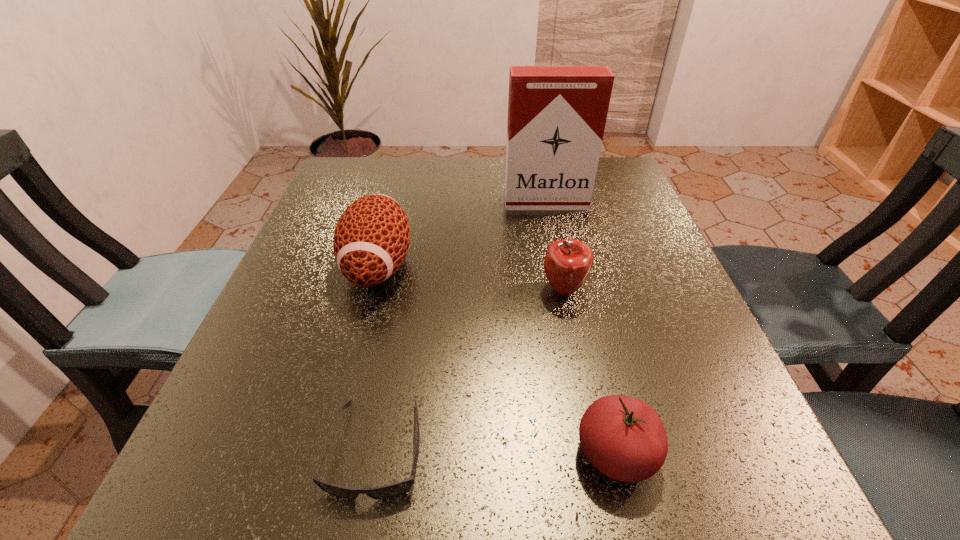
This screenshot has height=540, width=960. I want to click on the farthest object, so click(x=557, y=115).

The height and width of the screenshot is (540, 960). What are the coordinates of `the tallest object` in the screenshot? It's located at (557, 115).

The image size is (960, 540). I want to click on football, so click(371, 239).

This screenshot has width=960, height=540. I want to click on apple, so click(568, 262).

The image size is (960, 540). Find the location of `tomato`. tomato is located at coordinates (624, 438).

Where is `sunglasses`? Image resolution: width=960 pixels, height=540 pixels. sunglasses is located at coordinates (399, 488).

Locate an element on the screen. The width and height of the screenshot is (960, 540). blank area located 0.190m on the front-facing side of the tallest object is located at coordinates (559, 265).

The width and height of the screenshot is (960, 540). Find the location of `free point located on the right of the football`. free point located on the right of the football is located at coordinates [x=506, y=266].

The image size is (960, 540). I want to click on vacant space located on the front of the apple, so click(x=573, y=333).

The image size is (960, 540). Identify the location of free region located on the back of the tomato. (599, 380).